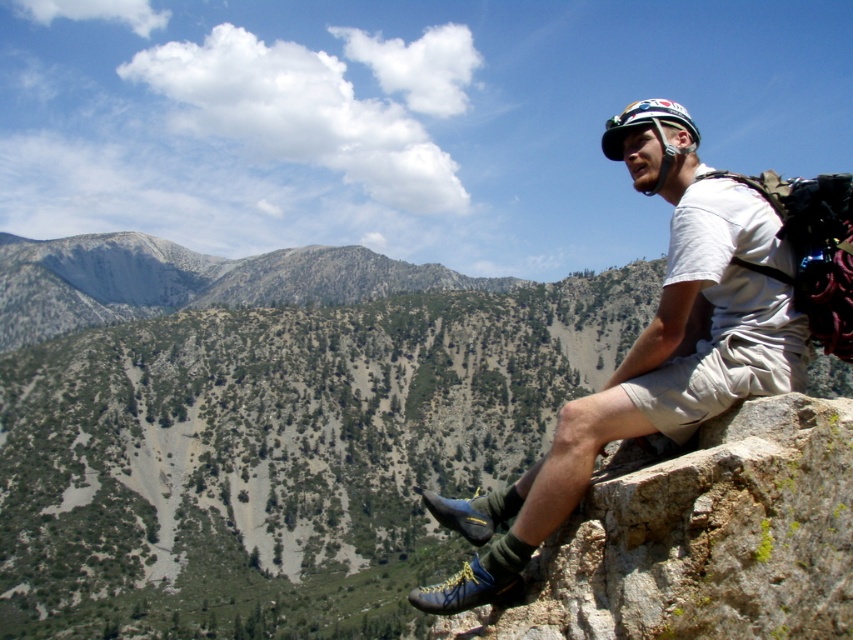
You are a photographer planning to take a wide shot of the climber and their gear. Given that the brown rough rock at lower right and the matte white helmet at upper right are both in the frame, which object would you need to zoom in more to capture in detail?

The brown rough rock at lower right has a lesser width compared to the matte white helmet at upper right, so you would need to zoom in more to capture the brown rough rock at lower right in detail since it is smaller in size.

You are a mountain guide assessing the safety of the climbing route. You notice the brown rough rock at lower right and the matte white helmet at upper right. Which object is positioned higher in the image?

The brown rough rock at lower right is above the matte white helmet at upper right in the image.

You are a photographer planning to take a photo of the climber. You notice the brown rough rock at lower right and the matte white helmet at upper right in your frame. Which object should you adjust your focus to ensure the smaller one is in sharp focus?

The brown rough rock at lower right is smaller than the matte white helmet at upper right, so you should adjust your focus to the brown rough rock at lower right to ensure the smaller one is in sharp focus.